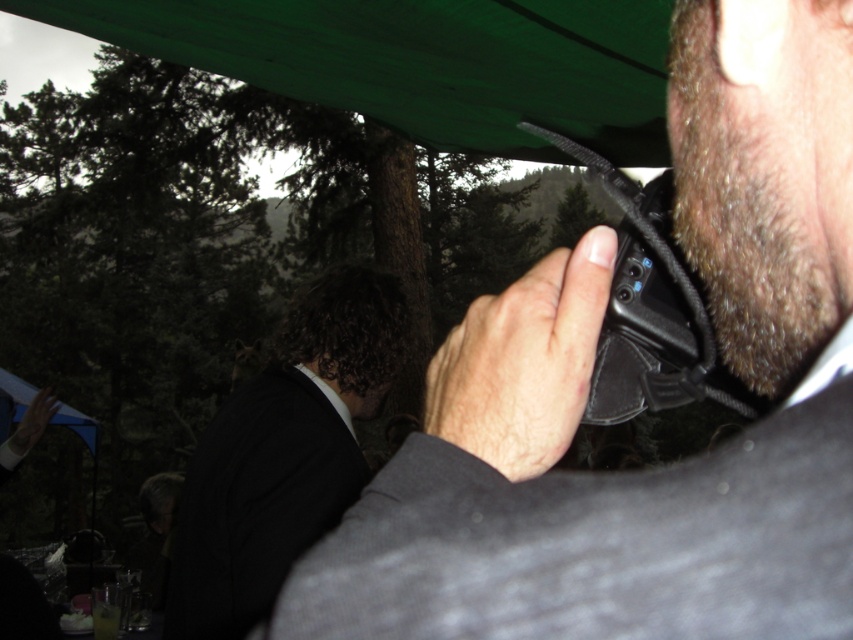
You are standing 1 meter away from the point at coordinates point (519, 13). Can you reach it without moving your feet?

The distance of point (519, 13) from viewer is 1.18 meters, so you are currently standing 1 meter away from it. Since the point is 0.18 meters beyond your reach, you cannot reach it without moving your feet.

You are a photographer trying to capture a photo of the dark brown fuzzy beard at right side without the green fabric canopy at upper center blocking the view. Can you adjust your camera angle to achieve this?

The green fabric canopy at upper center is taller than the dark brown fuzzy beard at right side, so lowering the camera angle might help avoid the canopy blocking the view of the beard.